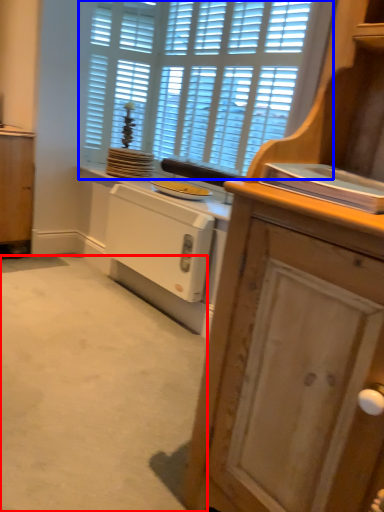
Question: Which object appears farthest to the camera in this image, plain (highlighted by a red box) or window (highlighted by a blue box)?

Choices:
 (A) plain
 (B) window

Answer: (B)